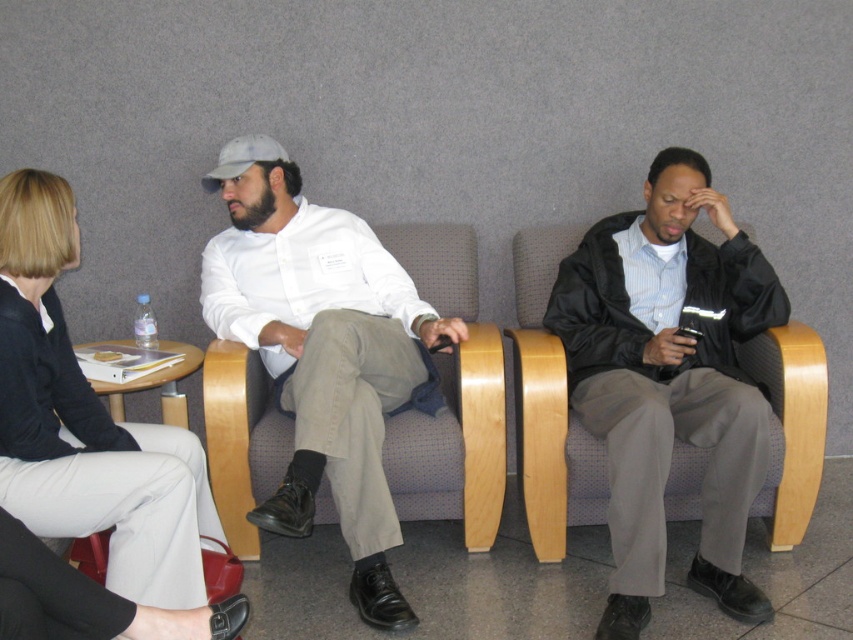
Question: Is the position of matte white shirt at center more distant than that of matte black blazer at center?

Choices:
 (A) no
 (B) yes

Answer: (B)

Question: Which is nearer to the black matte jacket at center?

Choices:
 (A) matte black blazer at center
 (B) matte white shirt at center

Answer: (B)

Question: Where is black matte jacket at center located in relation to matte black blazer at center in the image?

Choices:
 (A) above
 (B) below

Answer: (A)

Question: Is black matte jacket at center positioned in front of matte black blazer at center?

Choices:
 (A) no
 (B) yes

Answer: (A)

Question: Which of the following is the farthest from the observer?

Choices:
 (A) (376, 614)
 (B) (610, 252)
 (C) (28, 388)

Answer: (B)

Question: Among these points, which one is farthest from the camera?

Choices:
 (A) (68, 444)
 (B) (326, 376)
 (C) (711, 307)

Answer: (C)